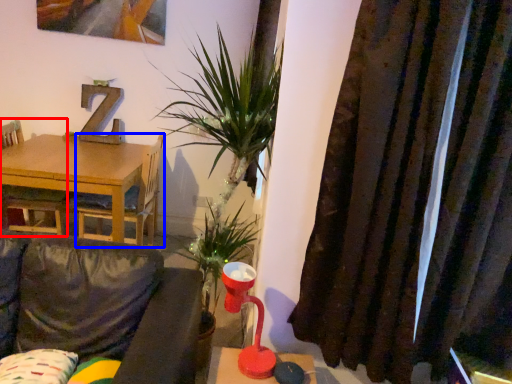
Question: Which point is closer to the camera, chair (highlighted by a red box) or chair (highlighted by a blue box)?

Choices:
 (A) chair
 (B) chair

Answer: (B)